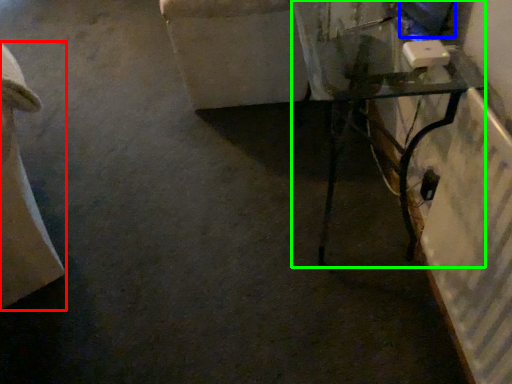
Question: Which object is the closest to the furniture (highlighted by a red box)? Choose among these: computer screen (highlighted by a blue box) or table (highlighted by a green box).

Choices:
 (A) computer screen
 (B) table

Answer: (B)